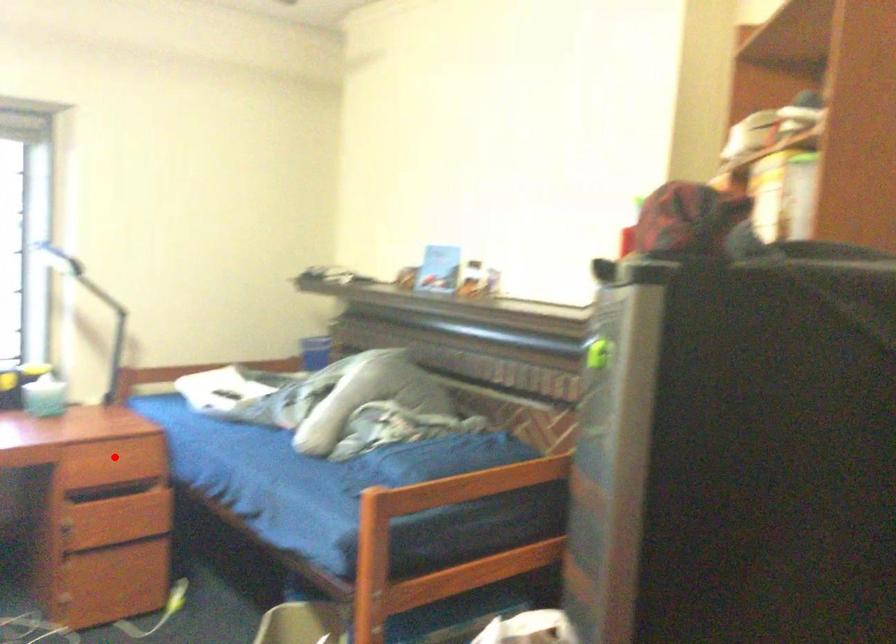
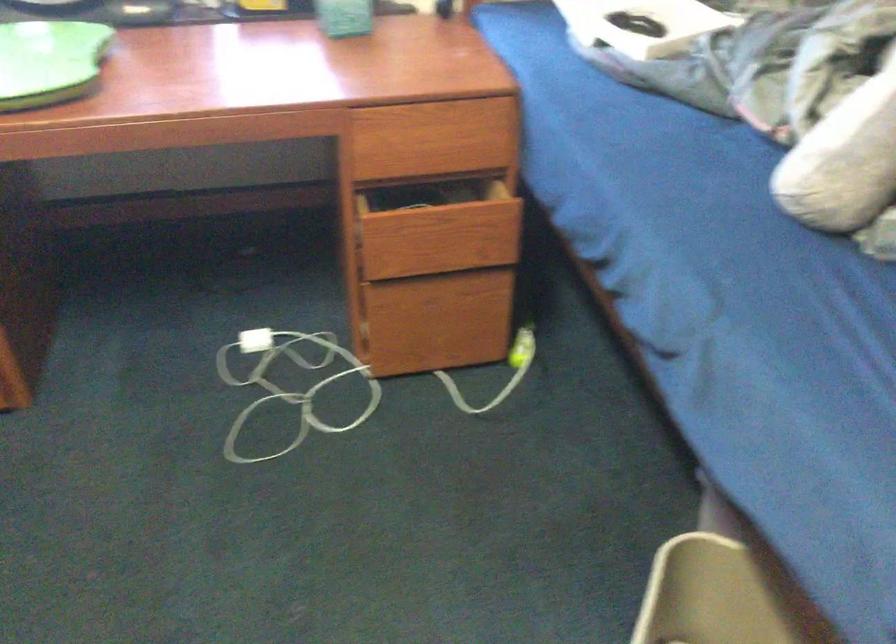
Question: I am providing you with two images of the same scene from different viewpoints. A red point is marked on the first image. Can you still see the location of the red point in image 2?

Choices:
 (A) Yes
 (B) No

Answer: (A)